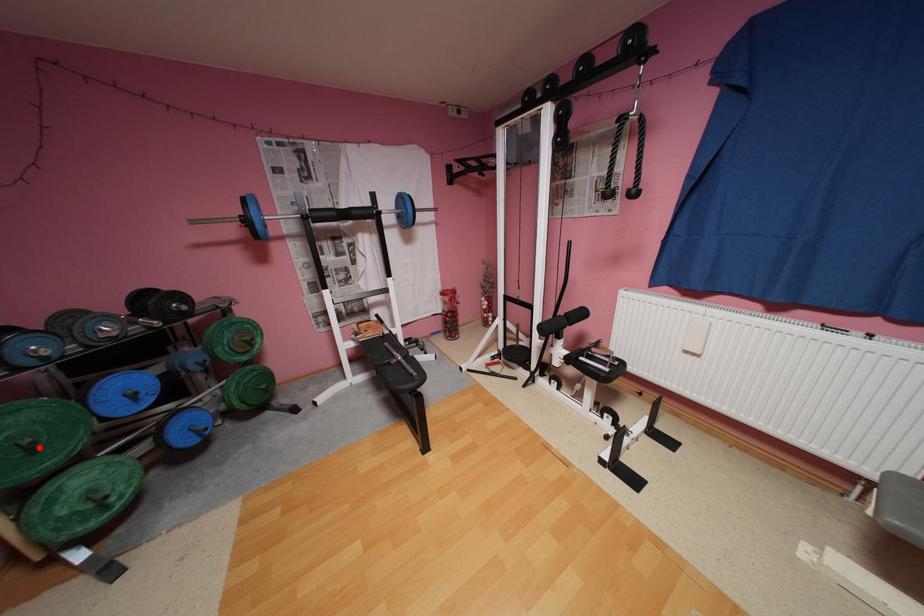
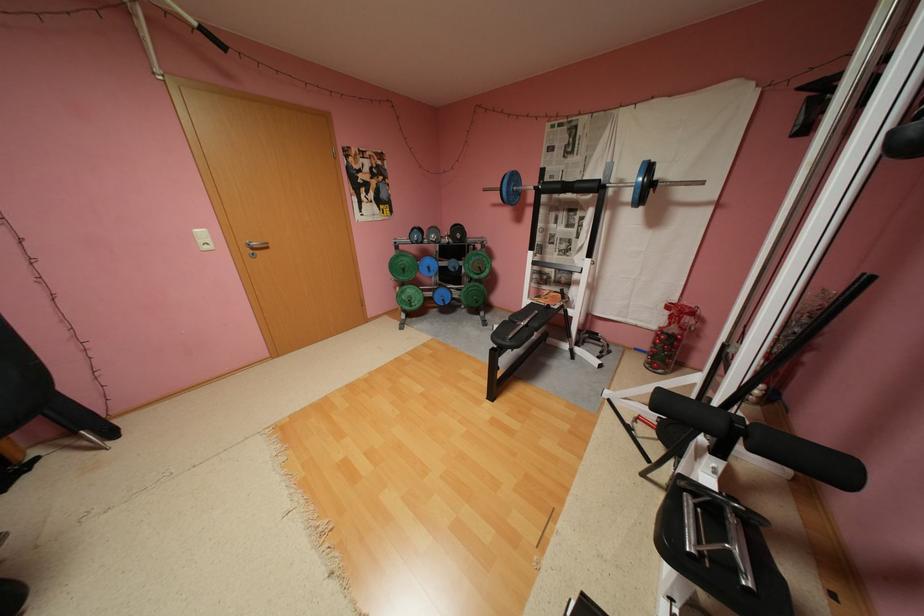
The point at the highlighted location is marked in the first image. Where is the corresponding point in the second image?

(412, 270)